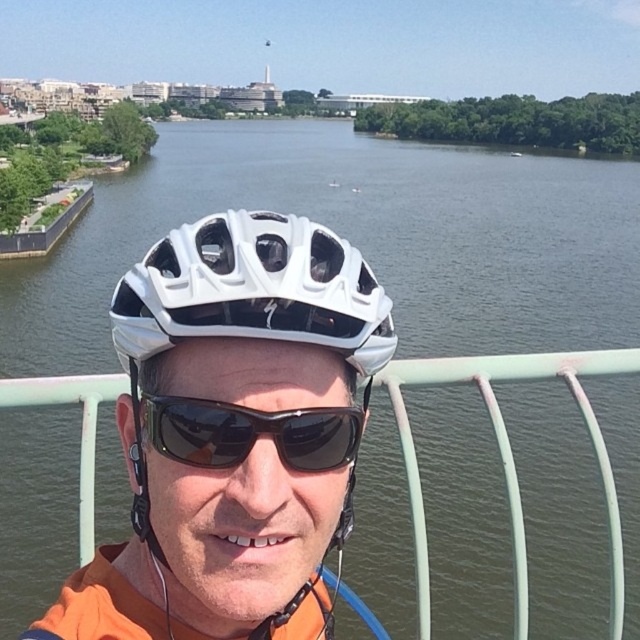
Question: Can you confirm if white metal rail at center is bigger than black matte sunglasses at center?

Choices:
 (A) no
 (B) yes

Answer: (B)

Question: Can you confirm if white matte helmet at center is positioned below black matte sunglasses at center?

Choices:
 (A) yes
 (B) no

Answer: (A)

Question: Does white metal rail at center have a greater width compared to black matte sunglasses at center?

Choices:
 (A) no
 (B) yes

Answer: (B)

Question: Which object appears closest to the camera in this image?

Choices:
 (A) white matte helmet at center
 (B) white metal rail at center

Answer: (A)

Question: Among these objects, which one is farthest from the camera?

Choices:
 (A) white metal rail at center
 (B) white matte helmet at center

Answer: (A)

Question: Which of the following is the farthest from the observer?

Choices:
 (A) (618, 628)
 (B) (176, 312)

Answer: (A)